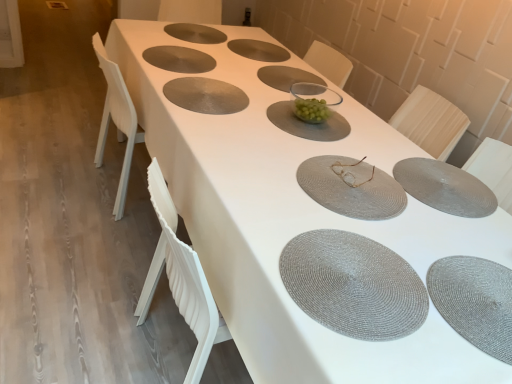
Find the location of a particular element. vacant position to the left of gold metallic glasses at center, which is the fourth tableware from bottom to top is located at coordinates (284, 155).